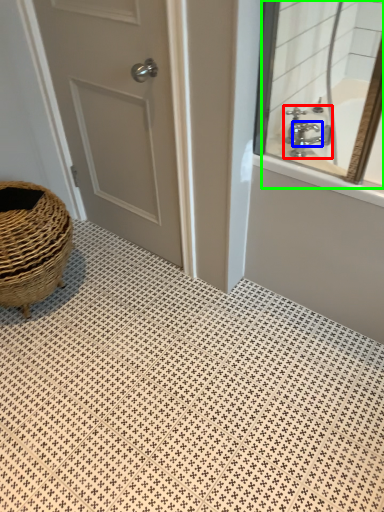
Question: Which object is positioned closest to tap (highlighted by a red box)? Select from faucet (highlighted by a blue box) and mirror (highlighted by a green box).

Choices:
 (A) faucet
 (B) mirror

Answer: (A)